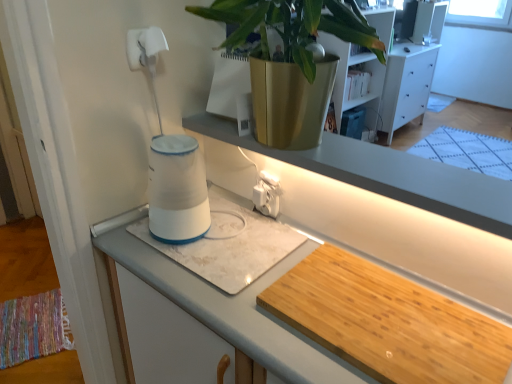
Locate an element on the screen. The image size is (512, 384). free space in front of white glossy water heater at center is located at coordinates (176, 273).